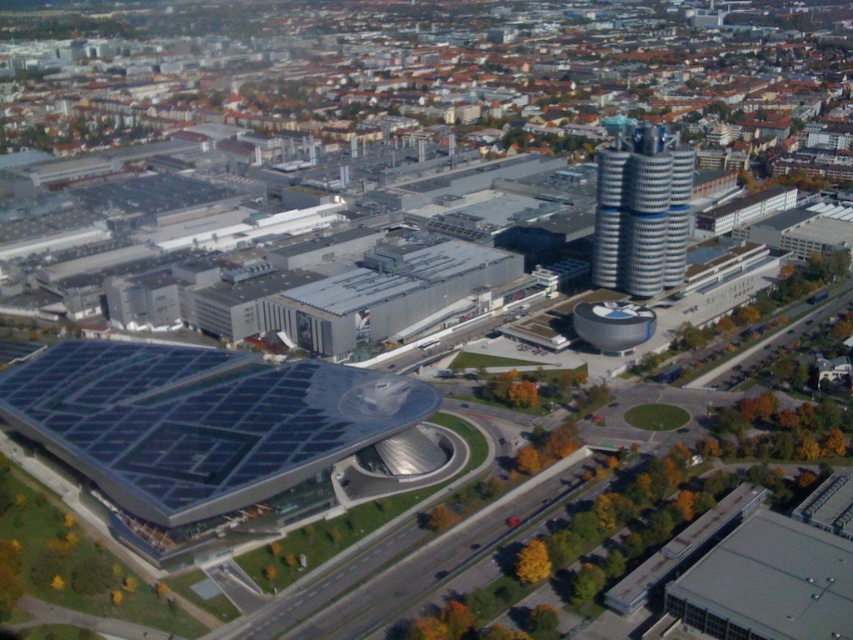
Question: Which point appears closest to the camera in this image?

Choices:
 (A) (675, 195)
 (B) (109, 378)

Answer: (B)

Question: Can you confirm if transparent glass roof at lower left is positioned above silver metallic tower at upper right?

Choices:
 (A) yes
 (B) no

Answer: (B)

Question: Can you confirm if transparent glass roof at lower left is bigger than silver metallic tower at upper right?

Choices:
 (A) yes
 (B) no

Answer: (A)

Question: Which point is farther to the camera?

Choices:
 (A) pos(604,237)
 (B) pos(415,388)

Answer: (A)

Question: Is transparent glass roof at lower left to the right of silver metallic tower at upper right from the viewer's perspective?

Choices:
 (A) yes
 (B) no

Answer: (B)

Question: Which point appears farthest from the camera in this image?

Choices:
 (A) (662, 176)
 (B) (161, 458)

Answer: (A)